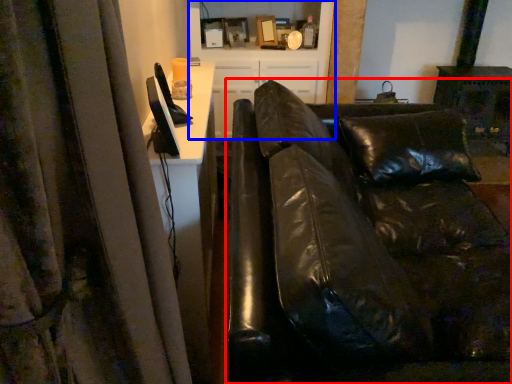
Question: Which of the following is the closest to the observer, studio couch (highlighted by a red box) or entertainment center (highlighted by a blue box)?

Choices:
 (A) studio couch
 (B) entertainment center

Answer: (A)